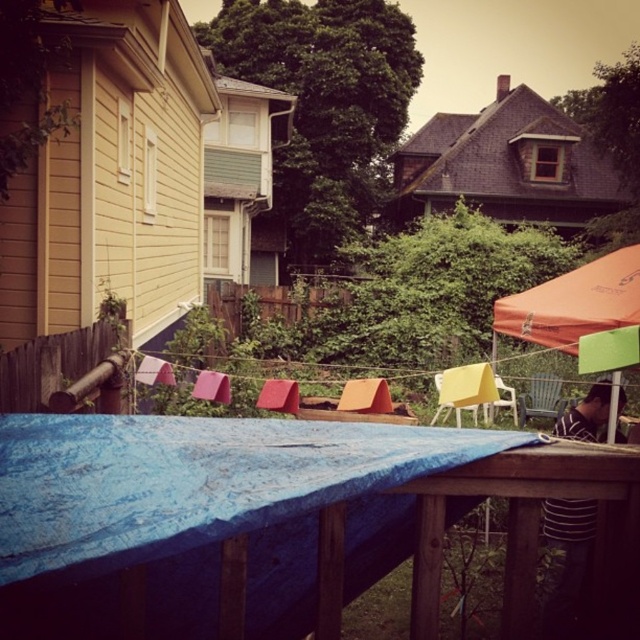
Question: Does orange fabric canopy at upper right have a greater width compared to wooden chair at right?

Choices:
 (A) yes
 (B) no

Answer: (A)

Question: Which is nearer to the blue tarp at center?

Choices:
 (A) brown wooden fence at left
 (B) orange fabric canopy at upper right
 (C) wooden chair at right
 (D) yellow plastic chair at center

Answer: (A)

Question: Which point appears closest to the camera in this image?

Choices:
 (A) (568, 410)
 (B) (554, 419)

Answer: (A)

Question: Where is brown wooden fence at left located in relation to wooden chair at right in the image?

Choices:
 (A) below
 (B) above

Answer: (B)

Question: Which is nearer to the orange fabric canopy at upper right?

Choices:
 (A) blue tarp at center
 (B) striped shirt at lower right
 (C) wooden chair at right
 (D) brown wooden fence at left

Answer: (B)

Question: Considering the relative positions of orange fabric canopy at upper right and yellow plastic chair at center in the image provided, where is orange fabric canopy at upper right located with respect to yellow plastic chair at center?

Choices:
 (A) right
 (B) left

Answer: (A)